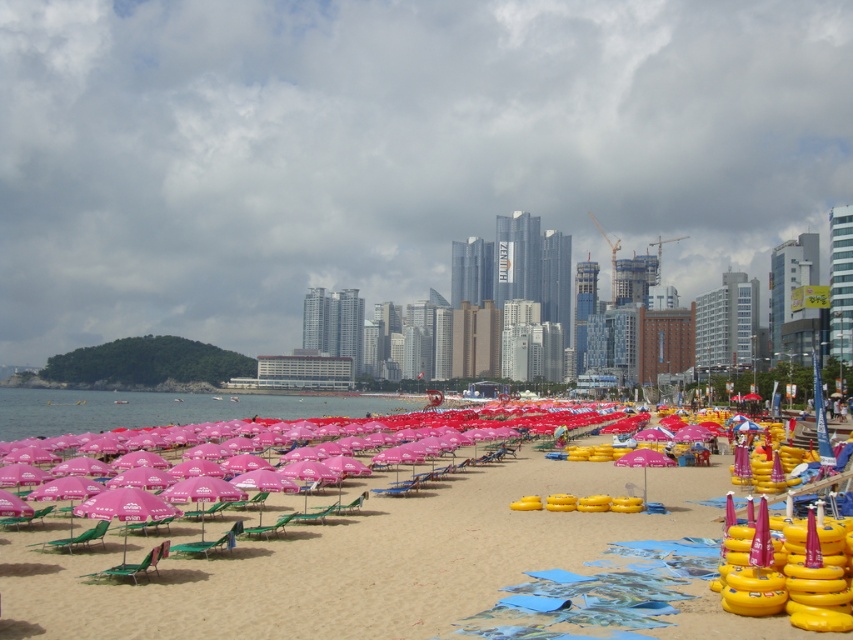
Question: From the image, what is the correct spatial relationship of sandy beach at center in relation to transparent water at center?

Choices:
 (A) above
 (B) below

Answer: (A)

Question: Where is sandy beach at center located in relation to transparent water at center in the image?

Choices:
 (A) above
 (B) below

Answer: (A)

Question: Which of the following is the farthest from the observer?

Choices:
 (A) sandy beach at center
 (B) transparent water at center

Answer: (B)

Question: Does sandy beach at center appear under transparent water at center?

Choices:
 (A) yes
 (B) no

Answer: (B)

Question: Which object appears farthest from the camera in this image?

Choices:
 (A) sandy beach at center
 (B) transparent water at center

Answer: (B)

Question: Which point appears farthest from the camera in this image?

Choices:
 (A) (489, 616)
 (B) (204, 400)

Answer: (B)